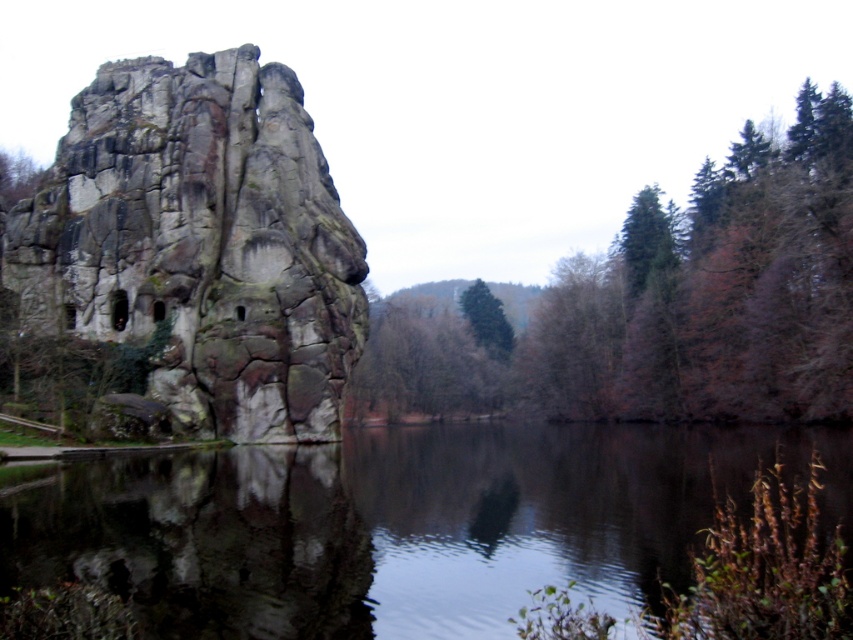
You are standing in the landscape and want to take a photo of both the smooth brown tree at right and the green textured tree at center. Which tree should you move closer to in order to include both in the frame without zooming?

You should move closer to the smooth brown tree at right because it is in front of the green textured tree at center, so moving closer to it will help include both in the frame without zooming.

Looking at this image, you are planning to plant a new tree in this landscape. The smooth brown tree at right has a wider trunk than the green textured tree at center. Which tree would you choose if you want a tree with a thicker trunk?

The smooth brown tree at right has a larger width than the green textured tree at center, so you should choose the smooth brown tree at right for a thicker trunk.

You are standing at the point marked as point [201,243] in the image. What object is located exactly at that point?

The rough stone rock formation at left is located at point [201,243].